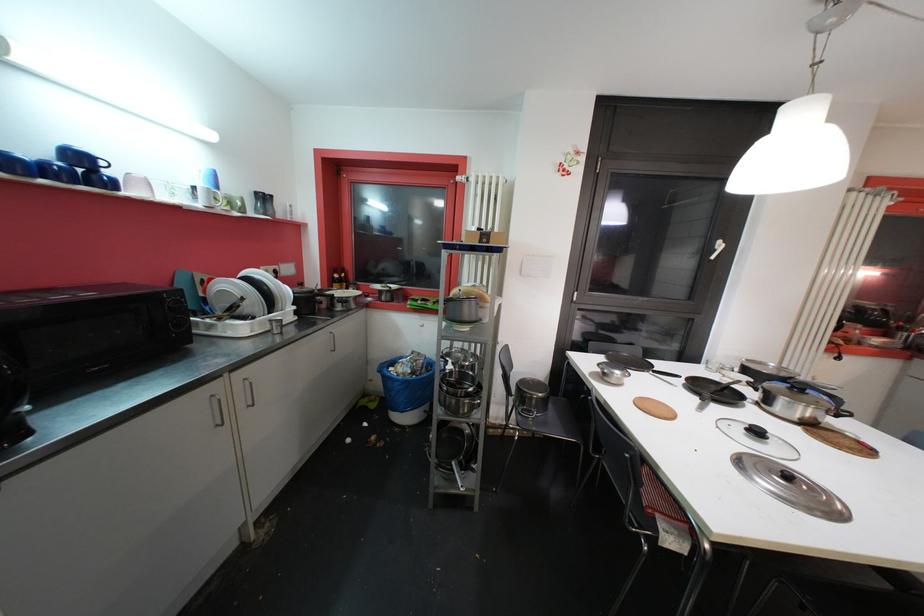
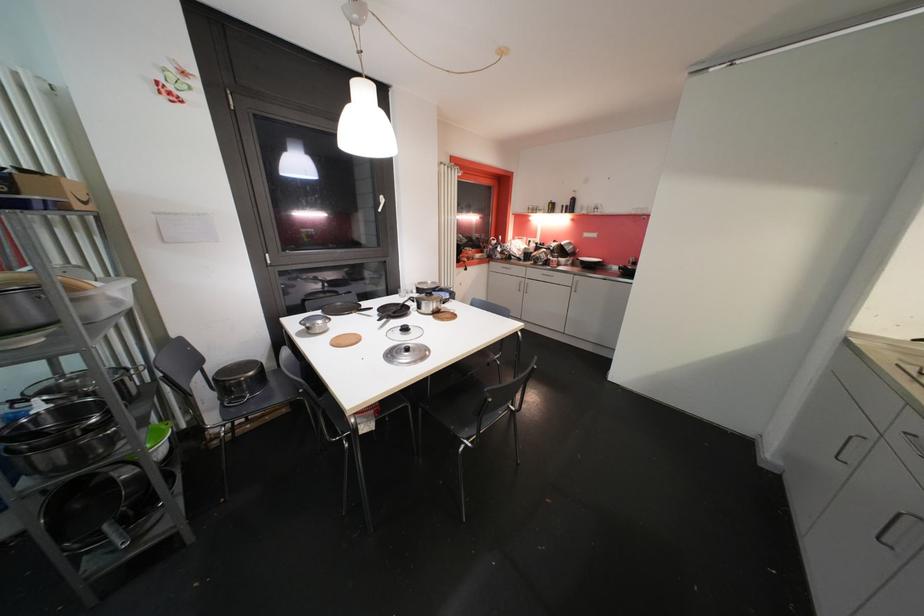
In the second image, find the point that corresponds to the point at 687,384 in the first image.

(379, 315)